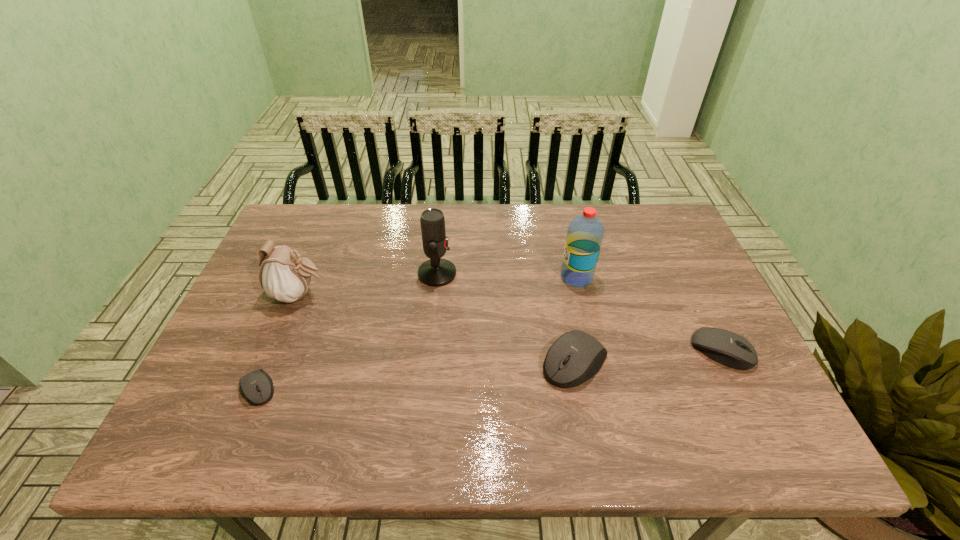
You are a GUI agent. You are given a task and a screenshot of the screen. Output one action in this format:
    pyautogui.click(x=<x>, y=<y>)
    Task: Click on the leftmost computer equipment
    
    Given the screenshot: What is the action you would take?
    pyautogui.click(x=257, y=386)

This screenshot has height=540, width=960. I want to click on the shortest computer equipment, so point(257,386).

What are the coordinates of `the second computer equipment from right to left` in the screenshot? It's located at (575, 357).

Find the location of a particular element. the second shortest object is located at coordinates (726, 347).

Find the location of `the rightmost computer equipment`. the rightmost computer equipment is located at coordinates (726, 347).

This screenshot has width=960, height=540. Identify the location of the fourth object from right to left. (437, 271).

In order to click on water bottle in this screenshot , I will do `click(585, 233)`.

Identify the location of the fourth shortest object. (285, 276).

Image resolution: width=960 pixels, height=540 pixels. I want to click on vacant space located on the back of the shortest object, so click(278, 340).

Where is `vacant region located 0.110m on the left of the second computer equipment from right to left`? The image size is (960, 540). vacant region located 0.110m on the left of the second computer equipment from right to left is located at coordinates (495, 362).